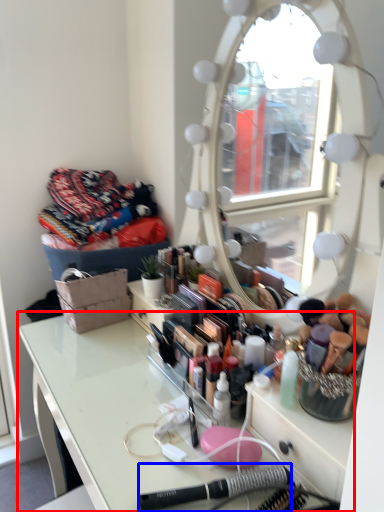
Question: Which point is closer to the camera, table (highlighted by a red box) or equipment (highlighted by a blue box)?

Choices:
 (A) table
 (B) equipment

Answer: (A)